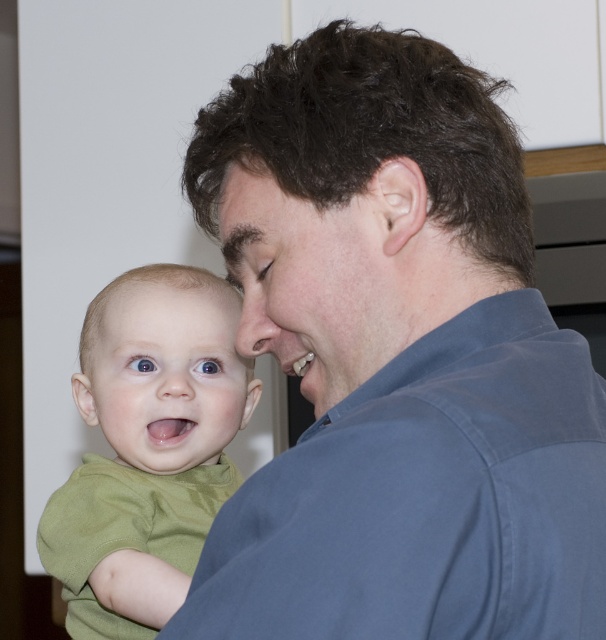
Is green cotton shirt at left thinner than smooth skin forehead at center?

No.

Is point (130, 445) closer to viewer compared to point (184, 307)?

Yes, it is.

Is point (88, 497) closer to camera compared to point (141, 323)?

Yes, point (88, 497) is closer to viewer.

You are a GUI agent. You are given a task and a screenshot of the screen. Output one action in this format:
    pyautogui.click(x=<x>, y=<y>)
    Task: Click on the green cotton shirt at left
    
    Given the screenshot: What is the action you would take?
    pyautogui.click(x=147, y=448)

Which is behind, point (227, 236) or point (244, 340)?

The point (244, 340) is behind.

Consider the image. Can you confirm if smooth skin face at center is bigger than smooth skin nose at center?

Yes, smooth skin face at center is bigger than smooth skin nose at center.

What are the coordinates of `smooth skin face at center` in the screenshot? It's located at click(x=305, y=280).

From the picture: Does green cotton shirt at left appear under smooth green baby face at center?

Yes, green cotton shirt at left is below smooth green baby face at center.

Which is more to the left, green cotton shirt at left or smooth green baby face at center?

From the viewer's perspective, green cotton shirt at left appears more on the left side.

Does point (122, 550) come closer to viewer compared to point (165, 460)?

Yes, it is.

This screenshot has width=606, height=640. Identify the location of green cotton shirt at left. (x=147, y=448).